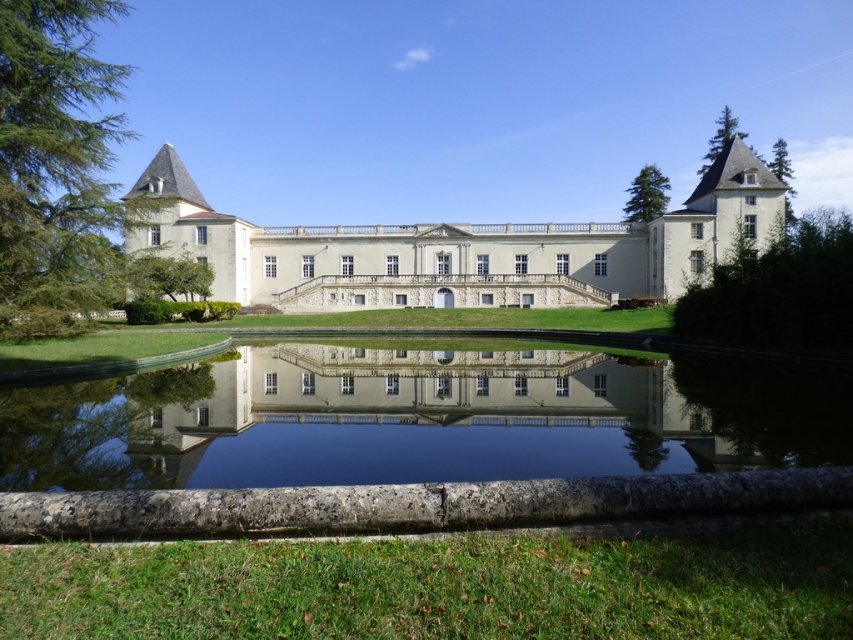
Which is more to the right, white smooth palace at center or green textured pine tree at upper right?

→ Positioned to the right is green textured pine tree at upper right.

Is white smooth palace at center bigger than green textured pine tree at upper right?

No.

Which is in front, point (524, 282) or point (701, 173)?

Point (524, 282)

Where is `white smooth palace at center`? white smooth palace at center is located at coordinates (463, 248).

Who is taller, green leafy tree at left or green leafy tree at right?

With more height is green leafy tree at left.

Between green leafy tree at left and green leafy tree at right, which one appears on the right side from the viewer's perspective?

green leafy tree at right is more to the right.

Between point (39, 115) and point (712, 323), which one is positioned behind?

Point (712, 323)

At what (x,y) coordinates should I click in order to perform the action: click on green leafy tree at left. Please return your answer as a coordinate pair (x, y). The width and height of the screenshot is (853, 640). Looking at the image, I should click on (56, 168).

Is point (724, 440) closer to viewer compared to point (722, 132)?

Yes, it is.

Describe the element at coordinates (419, 419) in the screenshot. The width and height of the screenshot is (853, 640). I see `transparent glass water at center` at that location.

Who is more distant from viewer, (x=621, y=468) or (x=722, y=113)?

The point (x=722, y=113) is behind.

This screenshot has height=640, width=853. Identify the location of transparent glass water at center. (419, 419).